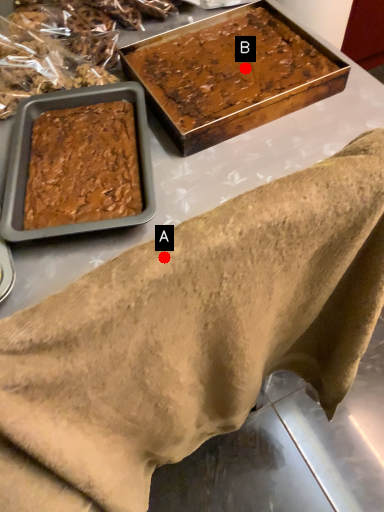
Question: Two points are circled on the image, labeled by A and B beside each circle. Which point is further to the camera?

Choices:
 (A) A is further
 (B) B is further

Answer: (B)